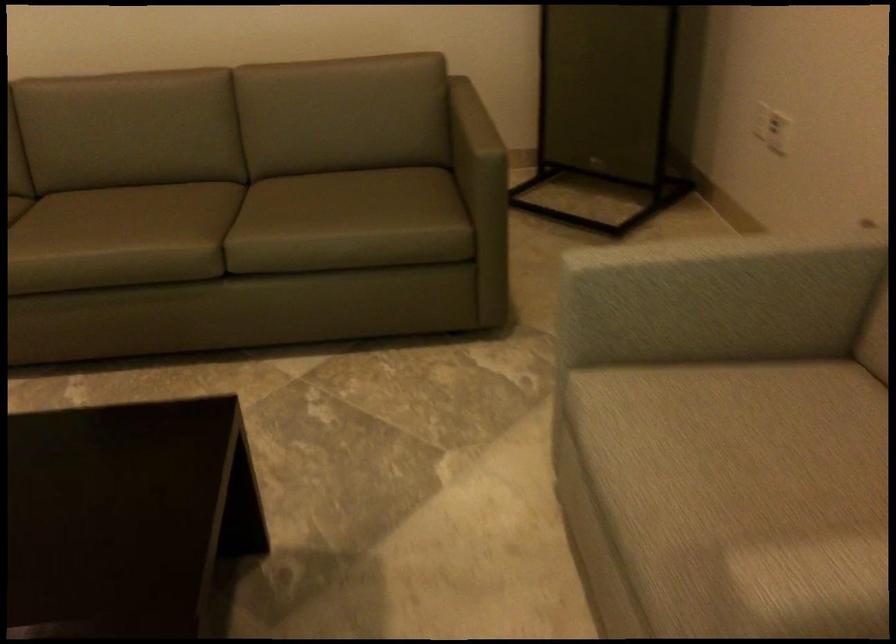
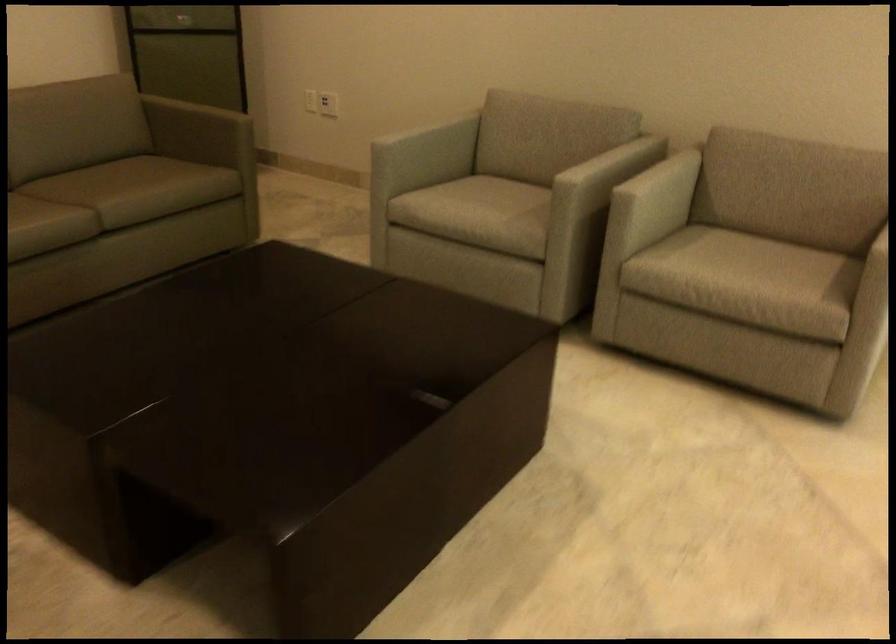
Where in the second image is the point corresponding to pixel 322 240 from the first image?

(145, 187)